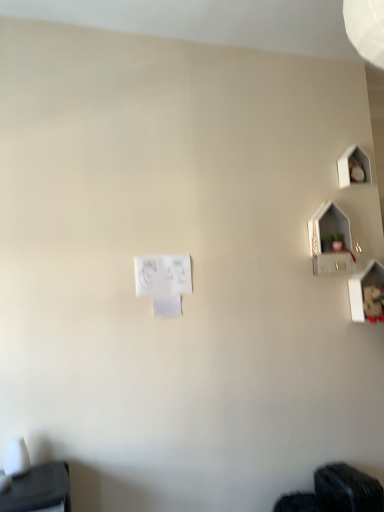
Question: From a real-world perspective, is black fabric at lower right positioned over white paper at center based on gravity?

Choices:
 (A) yes
 (B) no

Answer: (B)

Question: Does black fabric at lower right have a smaller size compared to white paper at center?

Choices:
 (A) yes
 (B) no

Answer: (B)

Question: Is black fabric at lower right facing towards white paper at center?

Choices:
 (A) no
 (B) yes

Answer: (A)

Question: From the image's perspective, does black fabric at lower right appear higher than white paper at center?

Choices:
 (A) yes
 (B) no

Answer: (B)

Question: Would you say white paper at center is part of black fabric at lower right's contents?

Choices:
 (A) no
 (B) yes

Answer: (A)

Question: Considering the relative positions of black fabric at lower right and white paper at center in the image provided, is black fabric at lower right to the left of white paper at center from the viewer's perspective?

Choices:
 (A) yes
 (B) no

Answer: (B)

Question: Considering the relative positions of black fabric at lower right and matte gray shelf at upper right in the image provided, is black fabric at lower right in front of matte gray shelf at upper right?

Choices:
 (A) yes
 (B) no

Answer: (A)

Question: Does black fabric at lower right have a lesser height compared to matte gray shelf at upper right?

Choices:
 (A) no
 (B) yes

Answer: (B)

Question: Is black fabric at lower right positioned with its back to matte gray shelf at upper right?

Choices:
 (A) no
 (B) yes

Answer: (A)

Question: Can you confirm if black fabric at lower right is smaller than matte gray shelf at upper right?

Choices:
 (A) yes
 (B) no

Answer: (B)

Question: Would you say black fabric at lower right is a long distance from matte gray shelf at upper right?

Choices:
 (A) no
 (B) yes

Answer: (B)

Question: Are black fabric at lower right and matte gray shelf at upper right making contact?

Choices:
 (A) yes
 (B) no

Answer: (B)

Question: Considering the relative positions of white paper at center and black fabric at lower right in the image provided, is white paper at center in front of black fabric at lower right?

Choices:
 (A) yes
 (B) no

Answer: (B)